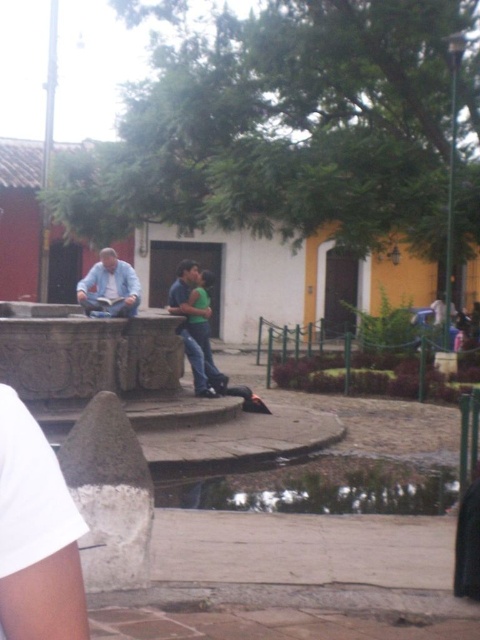
Question: Can you confirm if light blue denim shirt at center is positioned above matte blue jeans at center?

Choices:
 (A) yes
 (B) no

Answer: (A)

Question: Does clear water at lower center appear under light blue denim shirt at center?

Choices:
 (A) no
 (B) yes

Answer: (B)

Question: Which of these objects is positioned farthest from the matte blue jeans at center?

Choices:
 (A) clear water at lower center
 (B) light blue denim shirt at center

Answer: (A)

Question: Is clear water at lower center bigger than matte blue jeans at center?

Choices:
 (A) yes
 (B) no

Answer: (A)

Question: Which point is farther to the camera?

Choices:
 (A) clear water at lower center
 (B) matte blue jeans at center

Answer: (B)

Question: Estimate the real-world distances between objects in this image. Which object is closer to the matte blue jeans at center?

Choices:
 (A) clear water at lower center
 (B) light blue denim shirt at center

Answer: (B)